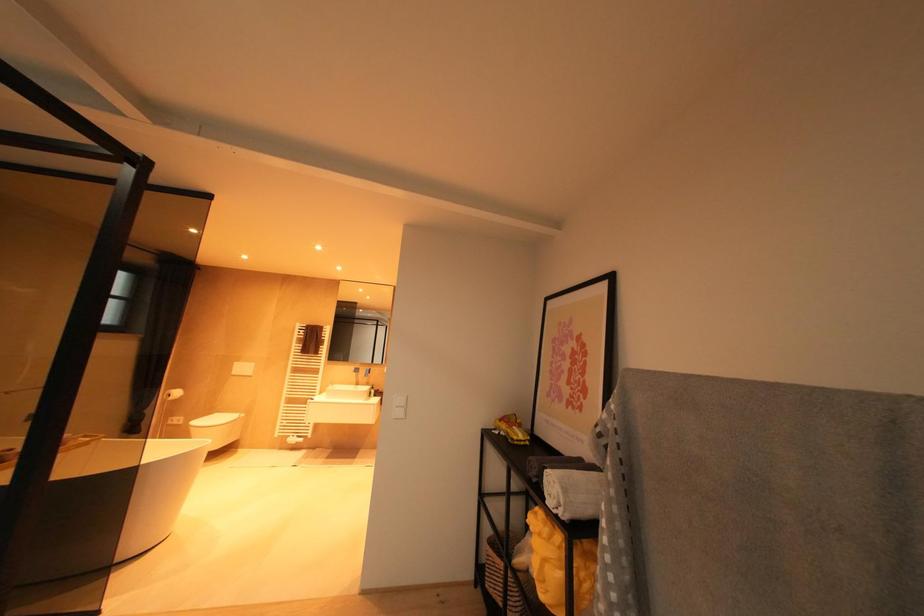
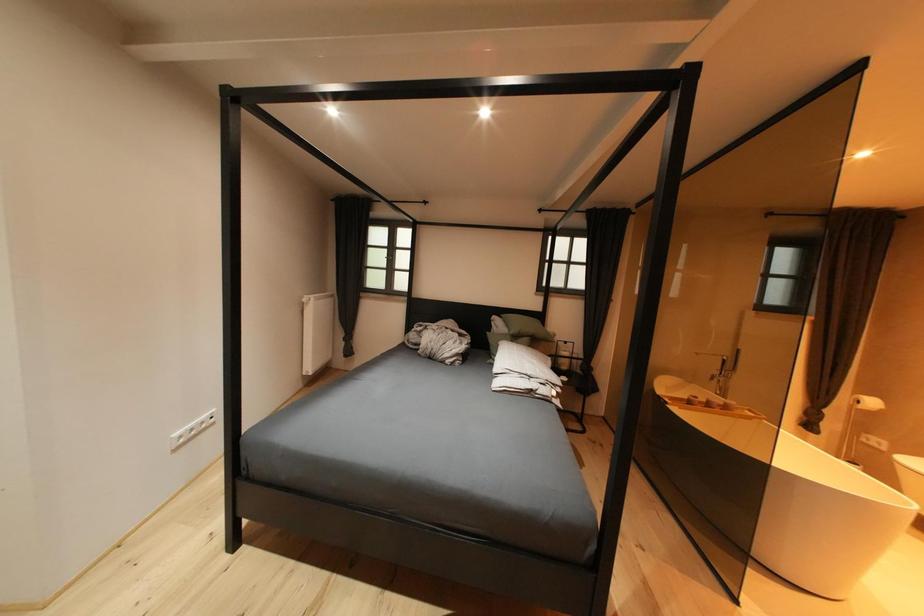
Question: The first image is from the beginning of the video and the second image is from the end. How did the camera likely rotate when shooting the video?

Choices:
 (A) Left
 (B) Right
 (C) Up
 (D) Down

Answer: (A)